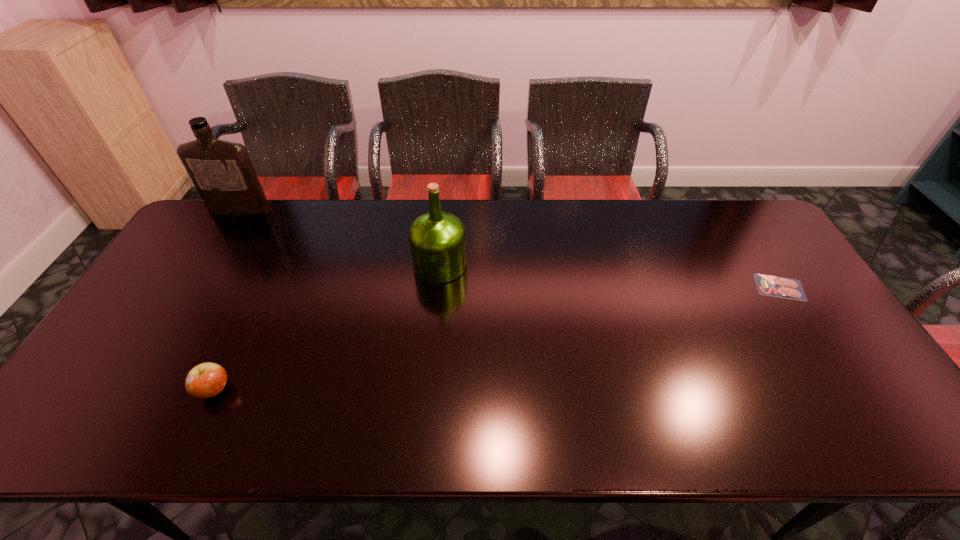
Point out which object is positioned as the nearest to the second object from right to left. Please provide its 2D coordinates. Your answer should be formatted as a tuple, i.e. [(x, y)], where the tuple contains the x and y coordinates of a point satisfying the conditions above.

[(206, 380)]

Identify the location of free space that satisfies the following two spatial constraints: 1. on the label side of the apple; 2. on the left side of the leftmost object. The height and width of the screenshot is (540, 960). (132, 389).

I want to click on free space that satisfies the following two spatial constraints: 1. on the label side of the apple; 2. on the left side of the farthest object, so click(132, 389).

The height and width of the screenshot is (540, 960). In order to click on vacant point that satisfies the following two spatial constraints: 1. on the label side of the olive oil; 2. on the right side of the farthest object in this screenshot , I will do `click(207, 265)`.

Where is `free location that satisfies the following two spatial constraints: 1. on the label side of the shortest object; 2. on the right side of the liquor`? The image size is (960, 540). free location that satisfies the following two spatial constraints: 1. on the label side of the shortest object; 2. on the right side of the liquor is located at coordinates (194, 287).

Find the location of a particular element. The image size is (960, 540). blank space that satisfies the following two spatial constraints: 1. on the label side of the liquor; 2. on the left side of the olive oil is located at coordinates (207, 265).

Locate an element on the screen. The height and width of the screenshot is (540, 960). free spot that satisfies the following two spatial constraints: 1. on the label side of the nearest object; 2. on the left side of the liquor is located at coordinates (132, 389).